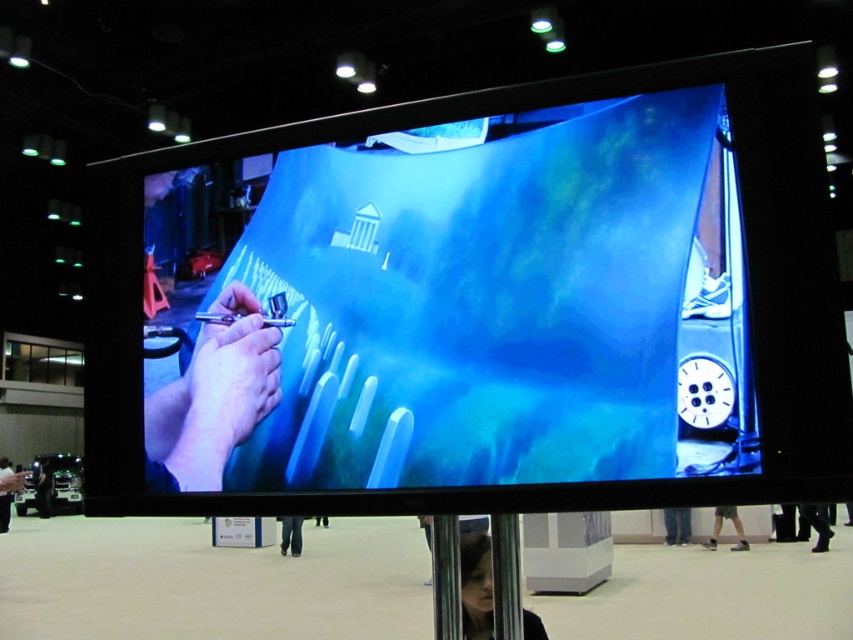
Question: Does smooth skin face at lower center appear under denim pants at lower center?

Choices:
 (A) no
 (B) yes

Answer: (A)

Question: Is the position of metallic pole at center more distant than that of black leather pants at lower center?

Choices:
 (A) no
 (B) yes

Answer: (A)

Question: Which object is the farthest from the smooth skin face at lower center?

Choices:
 (A) denim pants at lower center
 (B) dark gray fabric at lower right
 (C) black leather pants at lower center
 (D) smooth skin hands at center

Answer: (A)

Question: Which object is positioned closest to the smooth skin face at lower center?

Choices:
 (A) metallic pole at center
 (B) smooth skin hand at center

Answer: (A)

Question: Which object is farther from the camera taking this photo?

Choices:
 (A) blue matte painting at center
 (B) smooth black hand at center
 (C) black fabric at lower right

Answer: (B)

Question: Can you confirm if smooth skin face at lower center is positioned to the left of metallic pole at center?

Choices:
 (A) no
 (B) yes

Answer: (B)